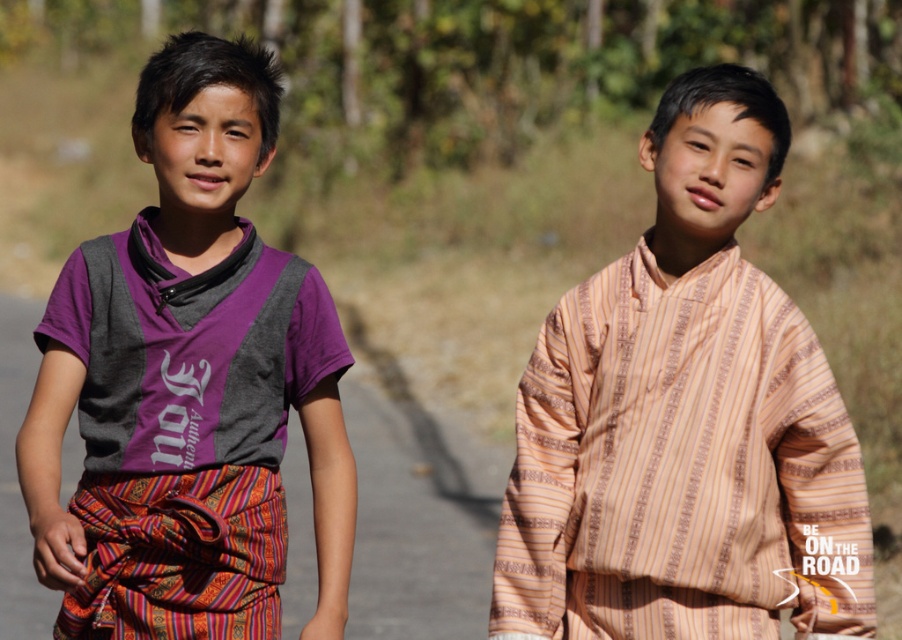
Who is shorter, striped cotton shirt at center or purple cotton shirt at center?

striped cotton shirt at center is shorter.

Between point (678, 408) and point (81, 548), which one is positioned in front?

Point (81, 548) is more forward.

Image resolution: width=902 pixels, height=640 pixels. In order to click on striped cotton shirt at center in this screenshot , I will do `click(686, 419)`.